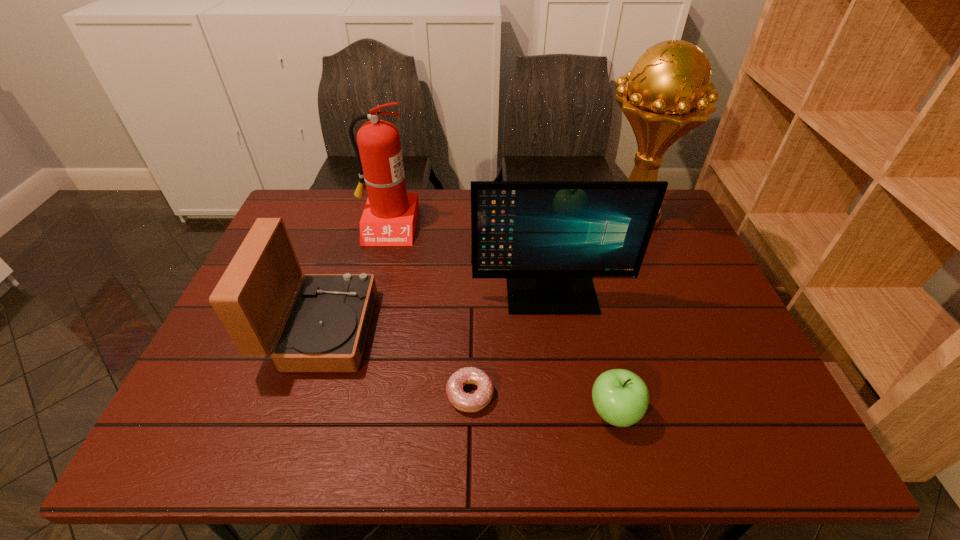
Locate an element on the screen. the tallest object is located at coordinates 665,98.

Where is `fire extinguisher`? fire extinguisher is located at coordinates (389, 218).

Where is `monitor`? This screenshot has height=540, width=960. monitor is located at coordinates (549, 239).

Find the location of a particular element. The height and width of the screenshot is (540, 960). the fourth tallest object is located at coordinates (325, 330).

Where is `apple`? The image size is (960, 540). apple is located at coordinates (621, 398).

Find the location of a particular element. The image size is (960, 540). doughnut is located at coordinates (465, 402).

Image resolution: width=960 pixels, height=540 pixels. I want to click on vacant region located at the front of the trophy_cup where the globe is prominent, so click(x=556, y=215).

Find the location of a particular element. This screenshot has height=540, width=960. blank space located 0.300m at the front of the trophy_cup where the globe is prominent is located at coordinates (497, 215).

The height and width of the screenshot is (540, 960). I want to click on blank area located at the front of the trophy_cup where the globe is prominent, so click(x=553, y=215).

Image resolution: width=960 pixels, height=540 pixels. I want to click on vacant area situated on the front-facing side of the fire extinguisher, so (366, 311).